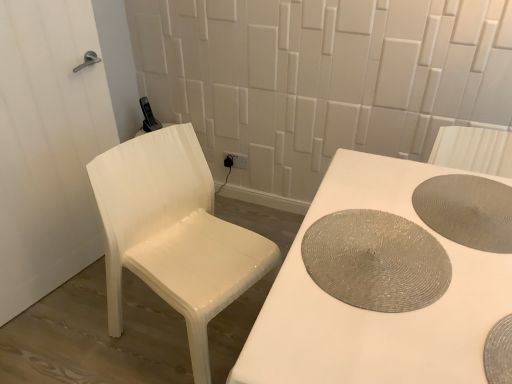
The image size is (512, 384). In order to click on vacant area on top of matte gray placemat at right, the 3th manhole cover from the front (from a real-world perspective) in this screenshot , I will do `click(468, 209)`.